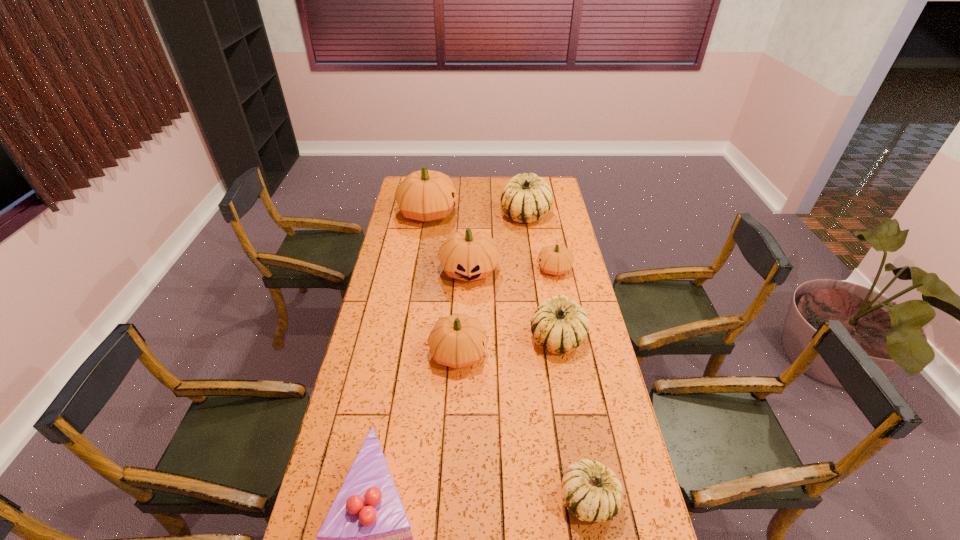
You are a GUI agent. You are given a task and a screenshot of the screen. Output one action in this format:
    pyautogui.click(x=<x>, y=<y>)
    Task: Click on the object present at the far left corner
    This screenshot has height=540, width=960.
    Given the screenshot: What is the action you would take?
    pyautogui.click(x=426, y=195)

The height and width of the screenshot is (540, 960). In the image, there is a desktop. In order to click on free space at the far edge in this screenshot , I will do `click(488, 197)`.

Where is `vacant area at the left edge of the desktop`? This screenshot has height=540, width=960. vacant area at the left edge of the desktop is located at coordinates (395, 249).

Locate an element on the screen. This screenshot has height=540, width=960. vacant space at the right edge is located at coordinates (576, 256).

What are the coordinates of `vacant point located between the third smallest orange gourd and the nearest gourd` in the screenshot? It's located at (529, 384).

What are the coordinates of `vacant space that is in between the nearest white gourd and the nearest orange gourd` in the screenshot? It's located at (x=523, y=426).

What are the coordinates of `free space between the nearest orange gourd and the smallest white gourd` in the screenshot? It's located at (523, 426).

I want to click on vacant region between the third biggest orange gourd and the biggest white gourd, so click(x=492, y=284).

Identify the location of vacant area that lies between the farthest white gourd and the second smallest orange gourd. The height and width of the screenshot is (540, 960). pos(492,284).

Identify the location of vacant region between the biggest white gourd and the farthest orange gourd. (477, 214).